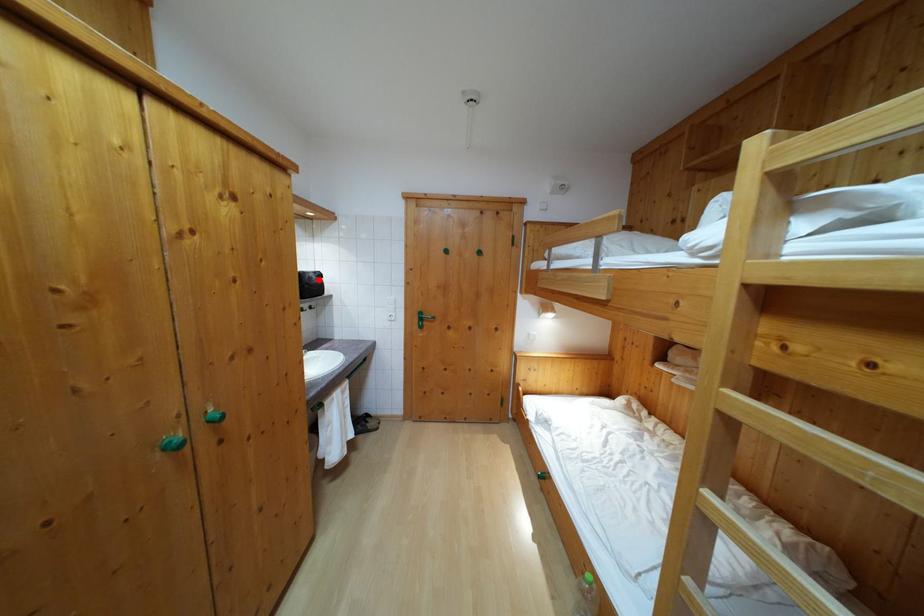
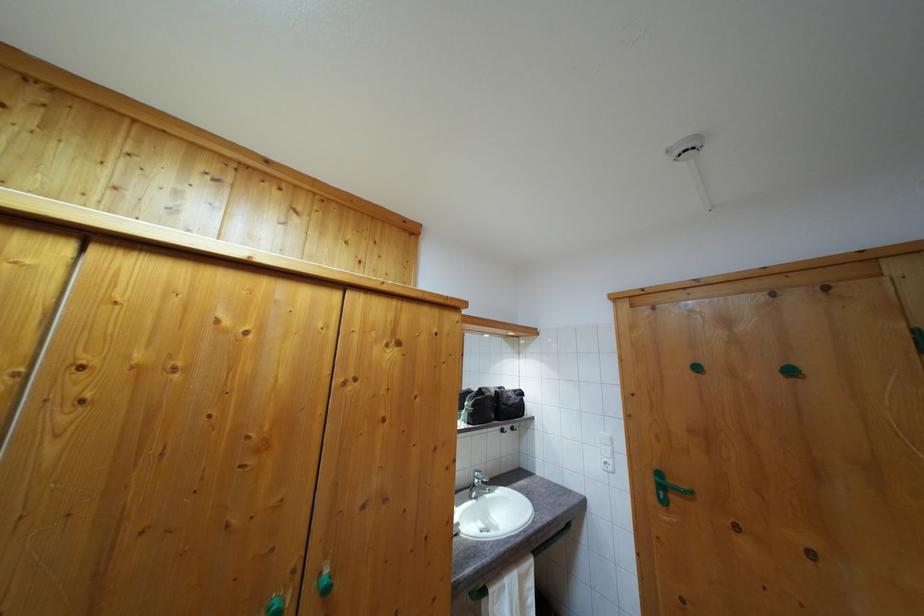
The point at the highlighted location is marked in the first image. Where is the corresponding point in the second image?

(518, 398)